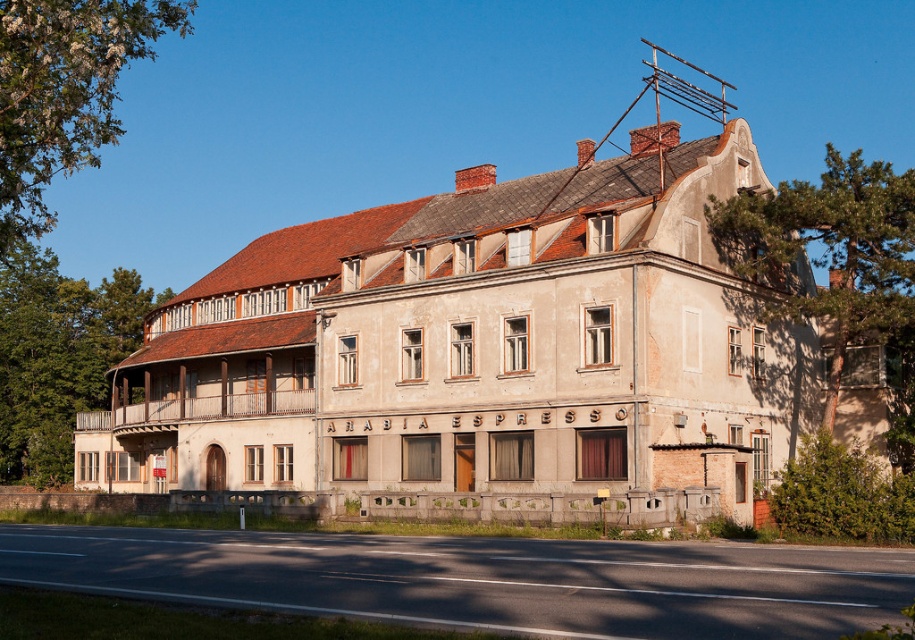
Is green leafy tree at upper left to the right of green leafy tree at left from the viewer's perspective?

Correct, you'll find green leafy tree at upper left to the right of green leafy tree at left.

Is green leafy tree at upper left shorter than green leafy tree at left?

Incorrect, green leafy tree at upper left's height does not fall short of green leafy tree at left's.

Is point (82, 93) less distant than point (22, 468)?

Yes, it is in front of point (22, 468).

The width and height of the screenshot is (915, 640). Identify the location of green leafy tree at upper left. (63, 92).

Is green leafy tree at upper right to the right of green leafy tree at left from the viewer's perspective?

Indeed, green leafy tree at upper right is positioned on the right side of green leafy tree at left.

Does green leafy tree at upper right have a smaller size compared to green leafy tree at left?

Actually, green leafy tree at upper right might be larger than green leafy tree at left.

Is point (741, 269) farther from camera compared to point (70, 422)?

No.

This screenshot has width=915, height=640. In order to click on green leafy tree at upper right in this screenshot , I will do `click(835, 262)`.

Describe the element at coordinates (835, 262) in the screenshot. I see `green leafy tree at upper right` at that location.

At what (x,y) coordinates should I click in order to perform the action: click on green leafy tree at upper right. Please return your answer as a coordinate pair (x, y). The image size is (915, 640). Looking at the image, I should click on (835, 262).

What do you see at coordinates (835, 262) in the screenshot? I see `green leafy tree at upper right` at bounding box center [835, 262].

You are a GUI agent. You are given a task and a screenshot of the screen. Output one action in this format:
    pyautogui.click(x=<x>, y=<y>)
    Task: Click on the green leafy tree at upper right
    
    Given the screenshot: What is the action you would take?
    tap(835, 262)